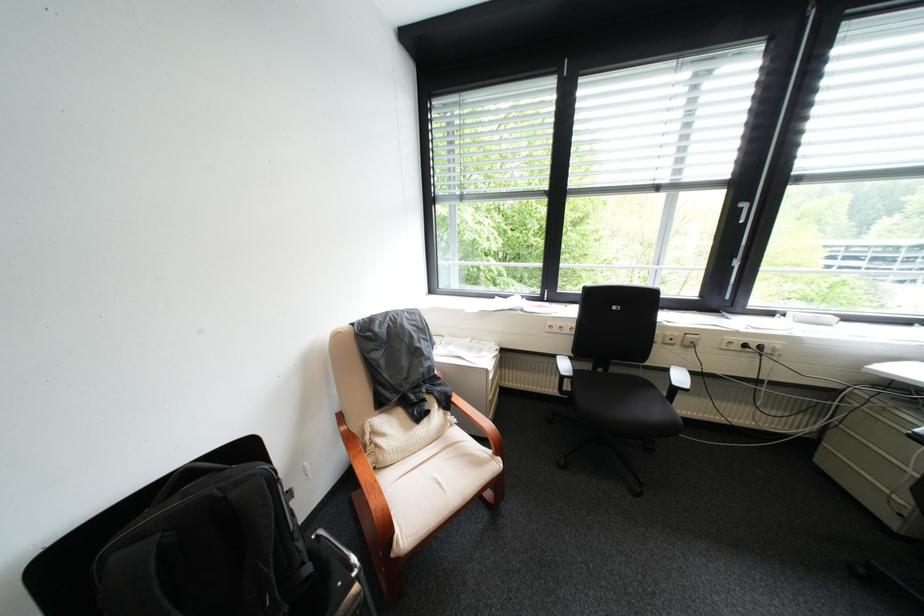
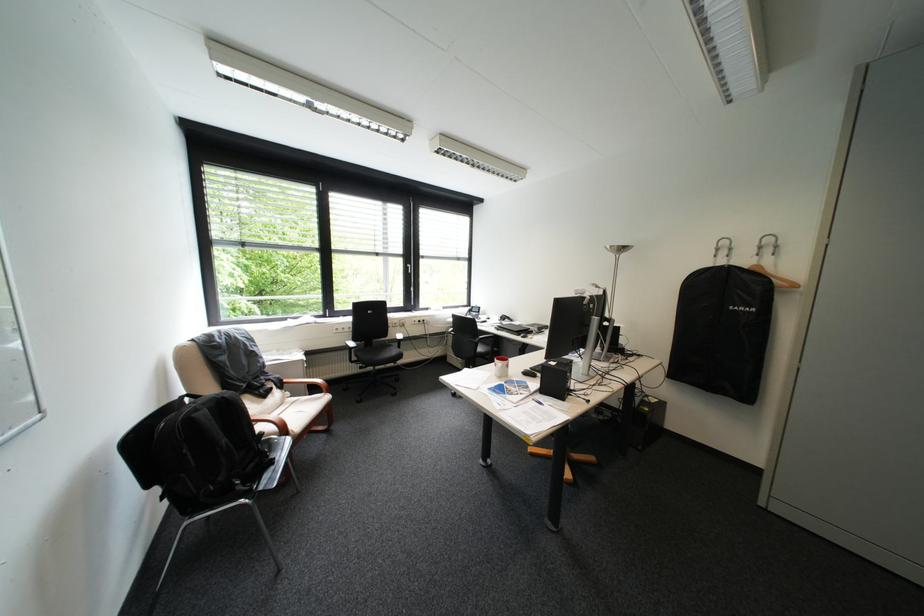
Find the pixel in the second image that matches point 463,397 in the first image.

(294, 381)